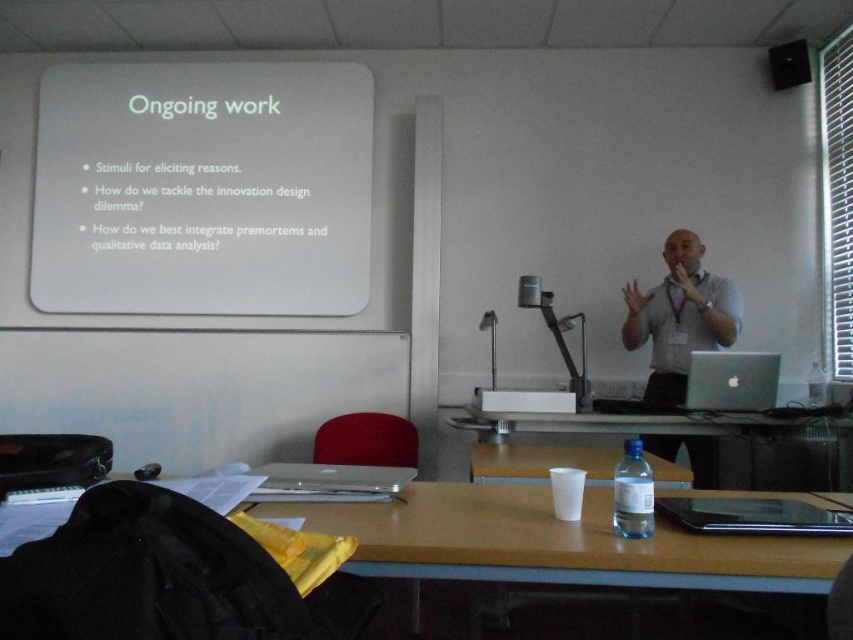
You are a student sitting in the classroom and want to focus on both the whiteboard and the presenter. Which of the two points, point (553, 422) or point (809, 81), is closer to you?

Point (553, 422) is closer to the camera than point (809, 81), so it is closer to you.

What object is located at the coordinates point (x=732, y=380)?

The silver metallic laptop at right is located at point (x=732, y=380).

You are a student in the classroom and you want to place both the clear plastic cup at center and the matte black speaker at upper right on a shelf that can only hold items smaller than the speaker. Can you put both items on the shelf?

The clear plastic cup at center is bigger than the matte black speaker at upper right. Since the shelf can only hold items smaller than the speaker, the cup cannot fit, so only the speaker can be placed on the shelf.